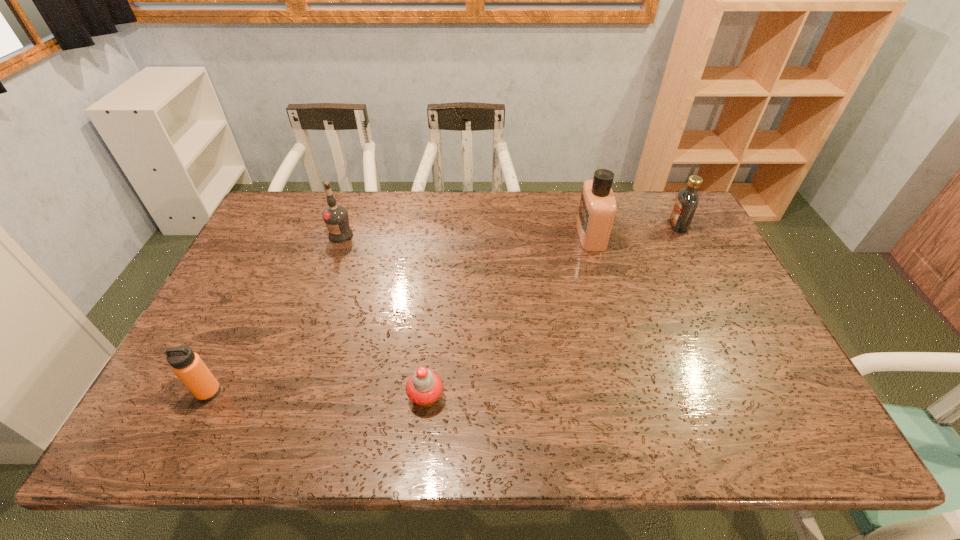
Where is `free space at the far edge of the desktop`? The width and height of the screenshot is (960, 540). free space at the far edge of the desktop is located at coordinates (419, 205).

In the image, there is a desktop. Where is `vacant space at the near edge`? vacant space at the near edge is located at coordinates (337, 428).

This screenshot has height=540, width=960. I want to click on vacant space at the left edge, so click(x=292, y=244).

Where is `vacant space at the right edge`? vacant space at the right edge is located at coordinates (736, 324).

In the image, there is a desktop. In order to click on vacant space at the near left corner in this screenshot , I will do `click(145, 436)`.

Identify the location of vacant space at the far right corner of the desktop. (653, 197).

This screenshot has width=960, height=540. What are the coordinates of `free space between the leftmost object and the left vodka` in the screenshot? It's located at (275, 313).

Locate an element on the screen. The image size is (960, 540). free area in between the thermos bottle and the right vodka is located at coordinates (444, 309).

The image size is (960, 540). What are the coordinates of `unoccupied position between the left vodka and the thermos bottle` in the screenshot? It's located at pos(275,313).

Locate an element on the screen. free space between the leftmost object and the perfume is located at coordinates (399, 313).